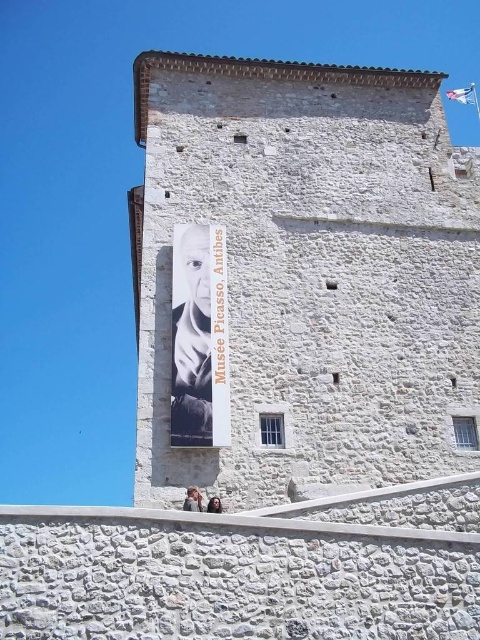
Which is more to the left, white stone tower at center or white paper poster at center?

From the viewer's perspective, white paper poster at center appears more on the left side.

Can you confirm if white stone tower at center is bigger than white paper poster at center?

Yes.

Where is `white stone tower at center`? white stone tower at center is located at coordinates (300, 282).